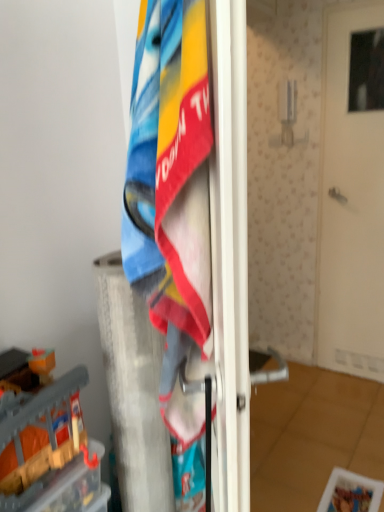
This screenshot has height=512, width=384. What are the coordinates of `vacant region below white matte door at center (from a real-world perspective)` in the screenshot? It's located at (349, 377).